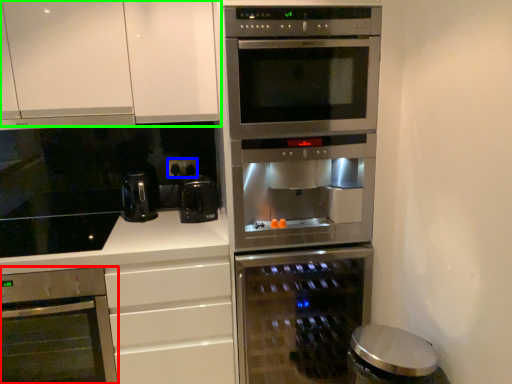
Question: Which is nearer to the oven (highlighted by a red box)? electric outlet (highlighted by a blue box) or cabinetry (highlighted by a green box).

Choices:
 (A) electric outlet
 (B) cabinetry

Answer: (B)